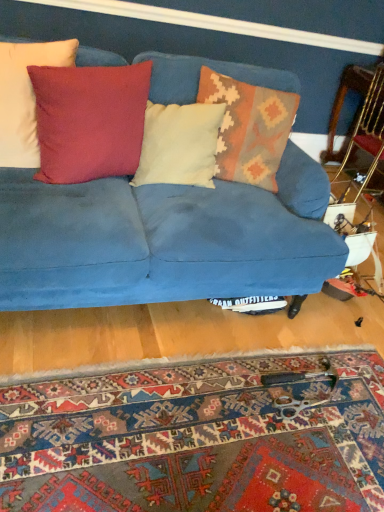
Where is `free space above carpet with intricate patterns at lower center (from a real-world perspective)`? The image size is (384, 512). free space above carpet with intricate patterns at lower center (from a real-world perspective) is located at coordinates (169, 452).